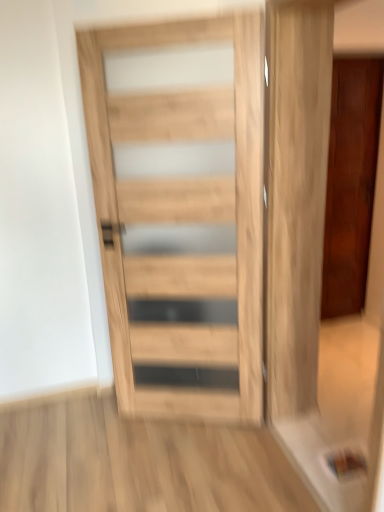
Question: Considering their positions, is natural wood door at center, arranged as the 2th door when viewed from the right, located in front of or behind shiny dark wood door at right, arranged as the second door when viewed from the left?

Choices:
 (A) front
 (B) behind

Answer: (A)

Question: Visually, is natural wood door at center, arranged as the 2th door when viewed from the right, positioned to the left or to the right of shiny dark wood door at right, arranged as the second door when viewed from the left?

Choices:
 (A) left
 (B) right

Answer: (A)

Question: Does point (231, 392) appear closer or farther from the camera than point (324, 309)?

Choices:
 (A) closer
 (B) farther

Answer: (A)

Question: Is shiny dark wood door at right, which is counted as the first door, starting from the right, bigger or smaller than natural wood door at center, the first door in the left-to-right sequence?

Choices:
 (A) small
 (B) big

Answer: (B)

Question: From a real-world perspective, relative to natural wood door at center, arranged as the 2th door when viewed from the right, is shiny dark wood door at right, arranged as the second door when viewed from the left, vertically above or below?

Choices:
 (A) below
 (B) above

Answer: (A)

Question: Considering their positions, is shiny dark wood door at right, which is counted as the first door, starting from the right, located in front of or behind natural wood door at center, arranged as the 2th door when viewed from the right?

Choices:
 (A) front
 (B) behind

Answer: (B)

Question: From the image's perspective, is shiny dark wood door at right, which ranks as the first door in back-to-front order, positioned above or below natural wood door at center, the first door in the left-to-right sequence?

Choices:
 (A) below
 (B) above

Answer: (B)